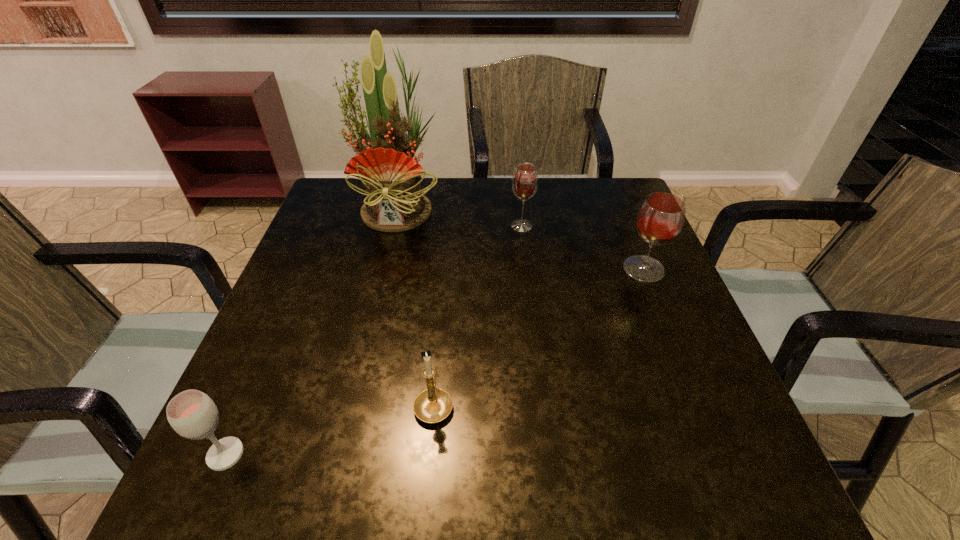
Identify the location of object that is at the right edge. tap(661, 216).

Locate an element on the screen. object that is at the far left corner is located at coordinates [391, 177].

The image size is (960, 540). I want to click on object that is at the near left corner, so click(x=192, y=414).

In the image, there is a desktop. Identify the location of vacant space at the far edge. Image resolution: width=960 pixels, height=540 pixels. [438, 218].

In the image, there is a desktop. Identify the location of vacant space at the near edge. (317, 505).

In the image, there is a desktop. Identify the location of vacant region at the left edge. (341, 343).

Locate an element on the screen. free spot at the right edge of the desktop is located at coordinates pyautogui.click(x=590, y=241).

This screenshot has width=960, height=540. I want to click on vacant space at the far left corner of the desktop, so [x=333, y=179].

Image resolution: width=960 pixels, height=540 pixels. Find the location of `blank space at the far right corner of the desktop`. blank space at the far right corner of the desktop is located at coordinates (597, 218).

The image size is (960, 540). I want to click on vacant space in between the second nearest object and the rightmost object, so click(539, 336).